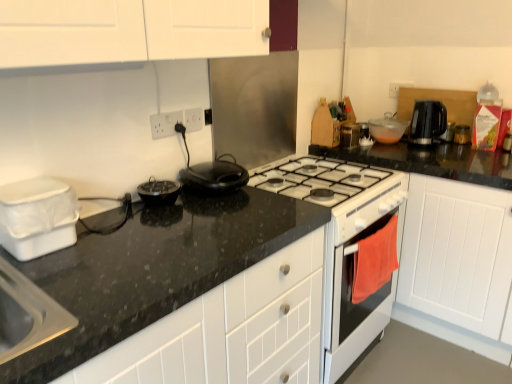
You are a GUI agent. You are given a task and a screenshot of the screen. Output one action in this format:
    pyautogui.click(x=<x>, y=<y>)
    Task: Click on the vacant area that lies between black matte waffle maker at center, which is counted as the 2th kitchen appliance, starting from the left, and white plastic container at left, placed as the seventh kitchen appliance when sorted from right to left
    This screenshot has width=512, height=384.
    Given the screenshot: What is the action you would take?
    pyautogui.click(x=123, y=222)